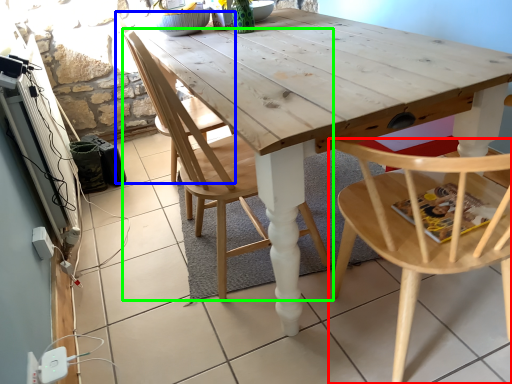
Question: Estimate the real-world distances between objects in this image. Which object is closer to chair (highlighted by a red box), chair (highlighted by a blue box) or chair (highlighted by a green box)?

Choices:
 (A) chair
 (B) chair

Answer: (B)